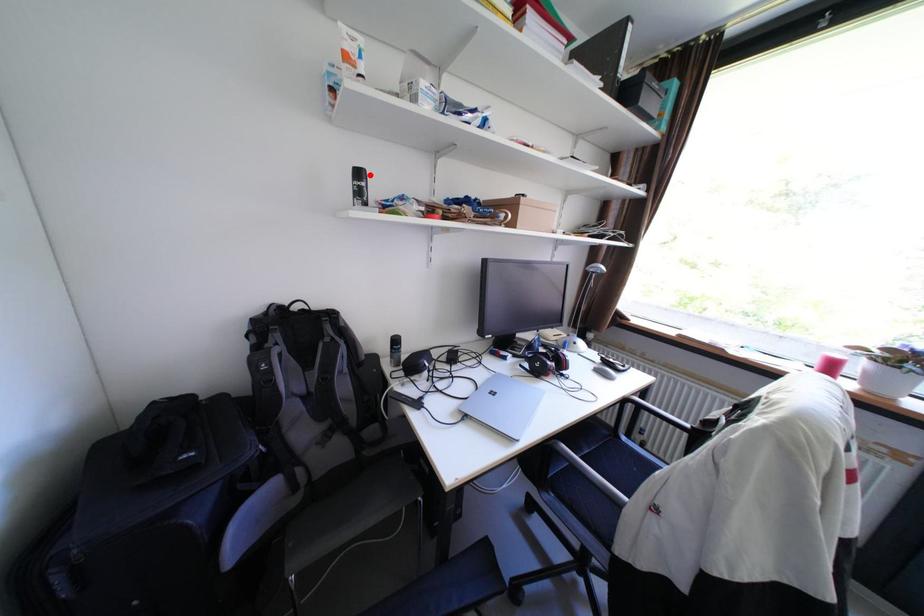
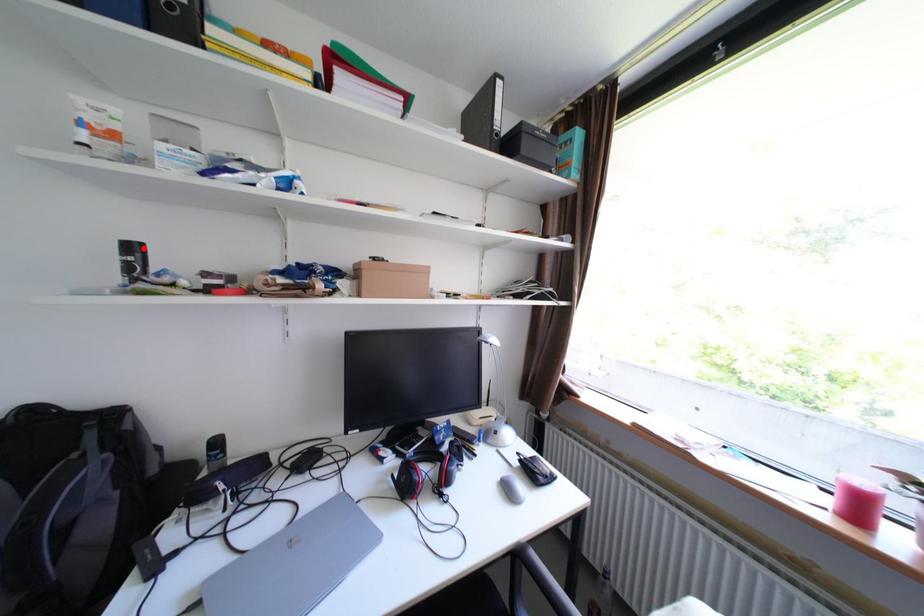
I am providing you with two images of the same scene from different viewpoints. A red point is marked on the first image and another point is marked on the second image. Is the marked point in image1 the same physical position as the marked point in image2?

Yes